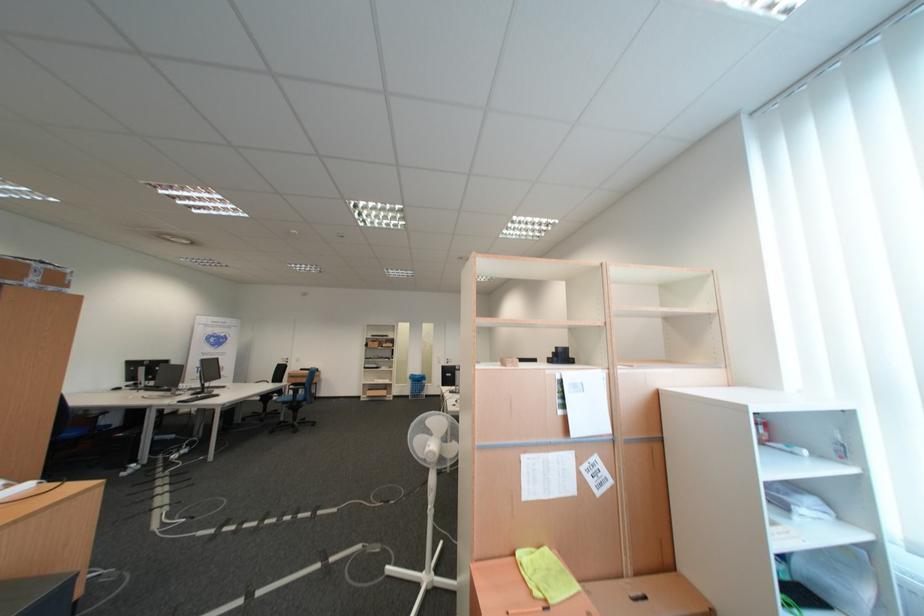
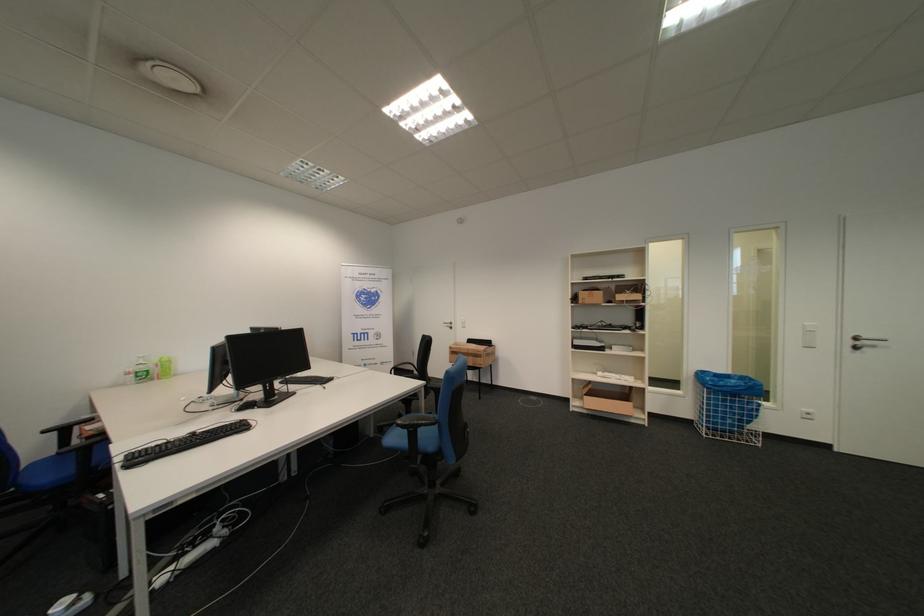
Locate, in the second image, the point that corresponds to [458,362] in the first image.

(862, 344)